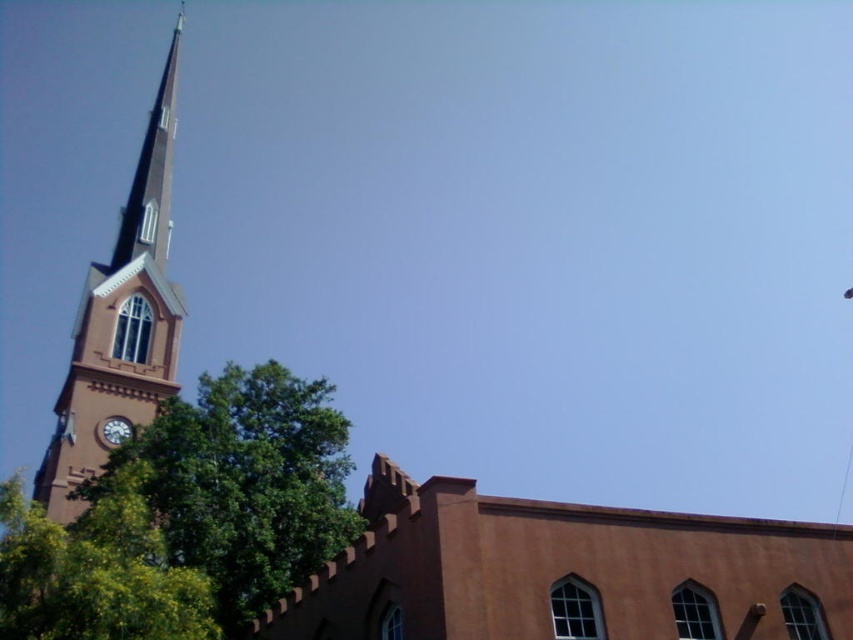
Question: Can you confirm if green leafy tree at center is positioned to the right of smooth brown clock tower at left?

Choices:
 (A) yes
 (B) no

Answer: (A)

Question: Among these objects, which one is nearest to the camera?

Choices:
 (A) brown matte church at center
 (B) smooth brown clock tower at left

Answer: (A)

Question: Does smooth brown clock tower at left have a smaller size compared to green leafy tree at lower left?

Choices:
 (A) no
 (B) yes

Answer: (A)

Question: Among these points, which one is nearest to the camera?

Choices:
 (A) (125, 433)
 (B) (65, 596)
 (C) (291, 438)

Answer: (B)

Question: Does green leafy tree at center have a larger size compared to green leafy tree at lower left?

Choices:
 (A) yes
 (B) no

Answer: (A)

Question: Which object is the closest to the matte brown clock at upper left?

Choices:
 (A) green leafy tree at lower left
 (B) smooth brown clock tower at left
 (C) green leafy tree at center
 (D) brown matte church at center

Answer: (C)